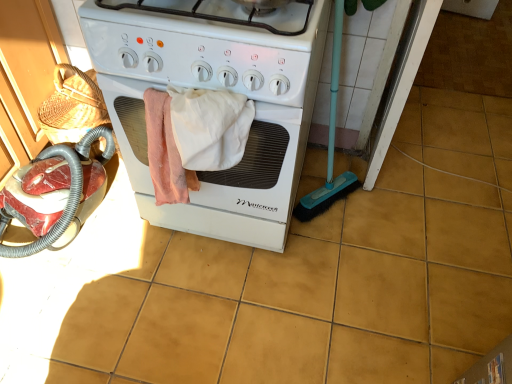
Where is `free space to the left of yellow matte tile at center`? Image resolution: width=512 pixels, height=384 pixels. free space to the left of yellow matte tile at center is located at coordinates (428, 189).